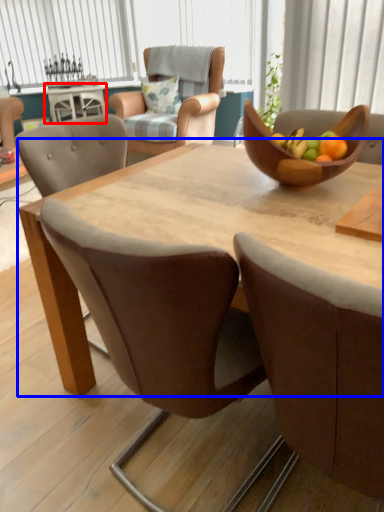
Question: Which of the following is the farthest to the observer, coffee table (highlighted by a red box) or round table (highlighted by a blue box)?

Choices:
 (A) coffee table
 (B) round table

Answer: (A)